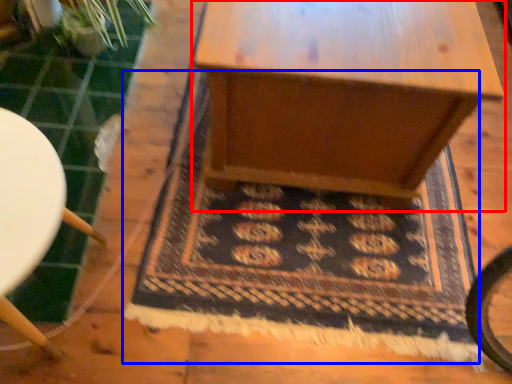
Question: Which point is further to the camera, table (highlighted by a red box) or mat (highlighted by a blue box)?

Choices:
 (A) table
 (B) mat

Answer: (B)